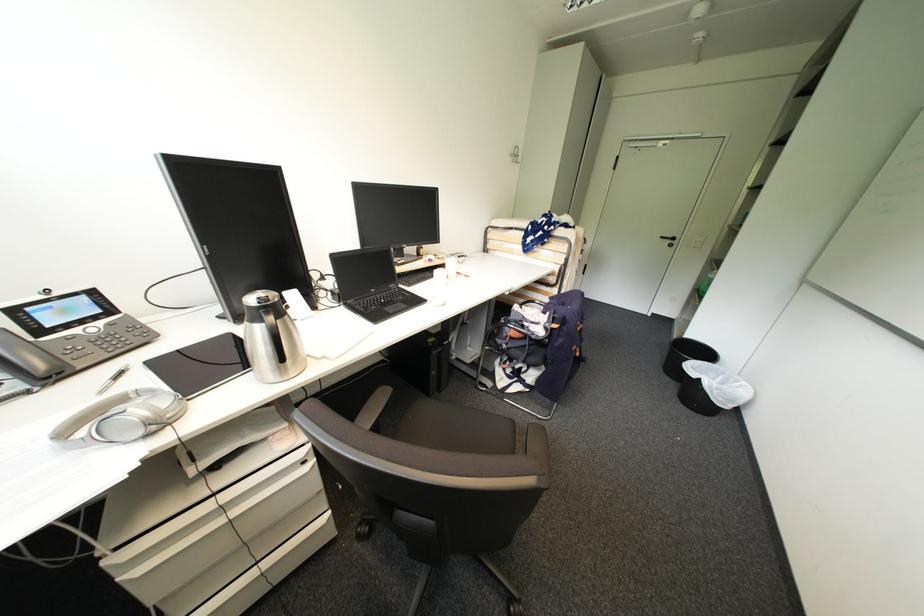
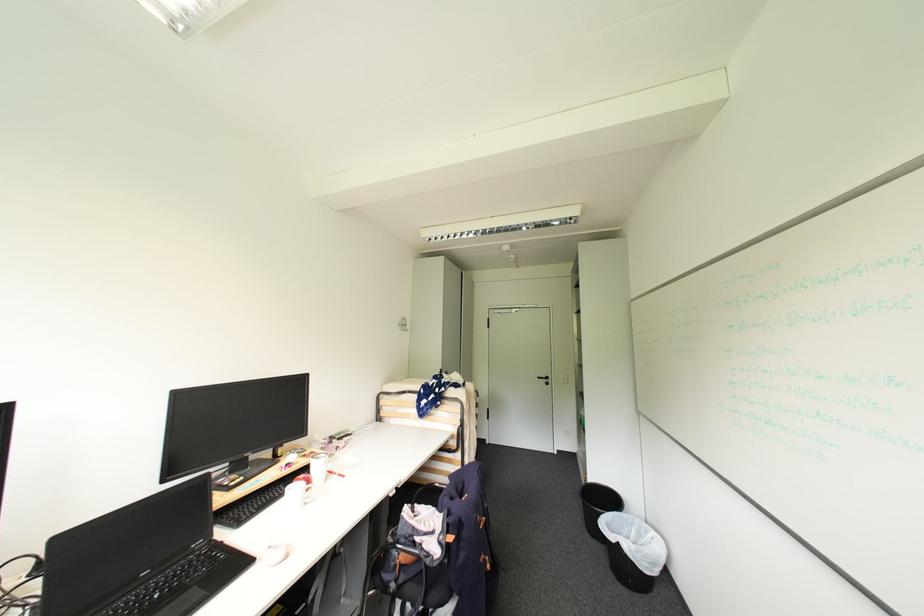
Where in the second image is the point corresponding to the point at 714,363 from the first image?

(624, 514)